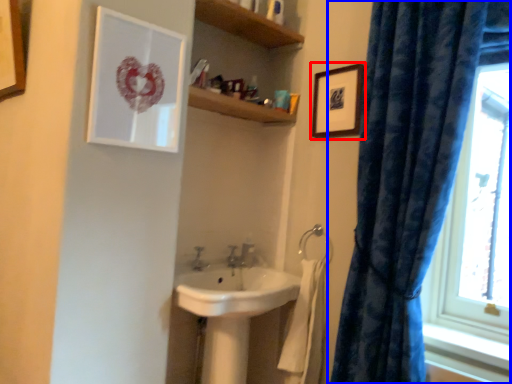
Question: Among these objects, which one is nearest to the camera, picture frame (highlighted by a red box) or curtain (highlighted by a blue box)?

Choices:
 (A) picture frame
 (B) curtain

Answer: (B)